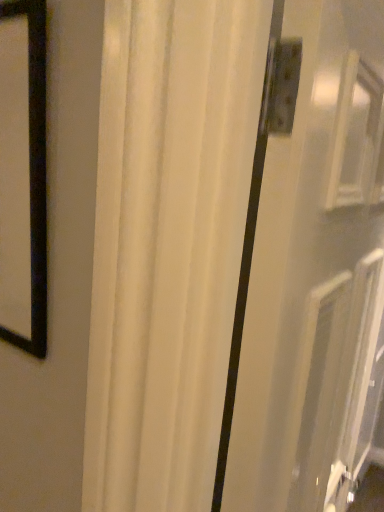
Question: Looking at the image, does white glossy screen door at center seem bigger or smaller compared to white matte curtain at center?

Choices:
 (A) big
 (B) small

Answer: (B)

Question: Choose the correct answer: Is white glossy screen door at center inside white matte curtain at center or outside it?

Choices:
 (A) inside
 (B) outside

Answer: (B)

Question: From a real-world perspective, relative to white matte curtain at center, is white glossy screen door at center vertically above or below?

Choices:
 (A) above
 (B) below

Answer: (A)

Question: From the image's perspective, relative to white glossy screen door at center, is white matte curtain at center above or below?

Choices:
 (A) above
 (B) below

Answer: (B)

Question: Would you say white matte curtain at center is inside or outside white glossy screen door at center?

Choices:
 (A) inside
 (B) outside

Answer: (B)

Question: In terms of width, does white matte curtain at center look wider or thinner when compared to white glossy screen door at center?

Choices:
 (A) thin
 (B) wide

Answer: (B)

Question: In terms of height, does white matte curtain at center look taller or shorter compared to white glossy screen door at center?

Choices:
 (A) tall
 (B) short

Answer: (A)